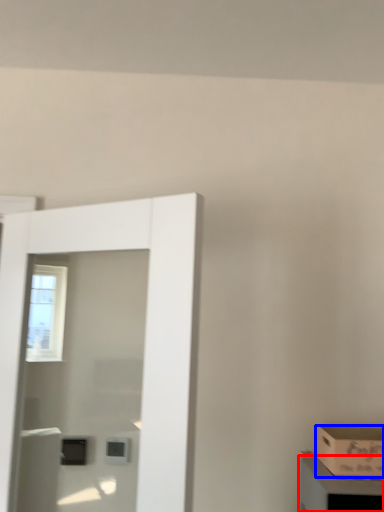
Question: Among these objects, which one is nearest to the camera, cabinetry (highlighted by a red box) or box (highlighted by a blue box)?

Choices:
 (A) cabinetry
 (B) box

Answer: (A)